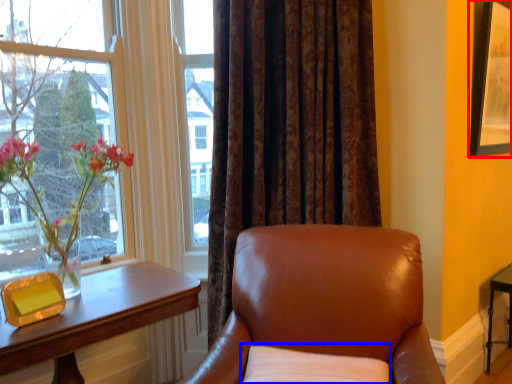
Question: Which object is closer to the camera taking this photo, picture frame (highlighted by a red box) or pillow (highlighted by a blue box)?

Choices:
 (A) picture frame
 (B) pillow

Answer: (B)